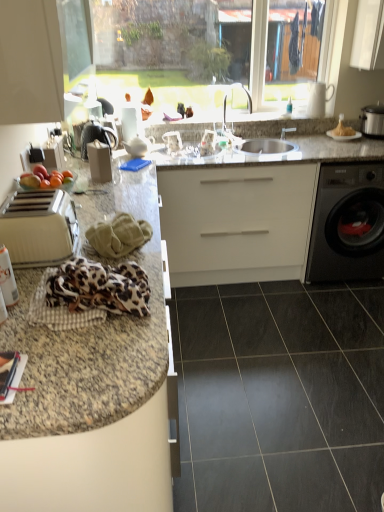
Question: Are white glossy plate at upper right and matte black magazine at lower left beside each other?

Choices:
 (A) no
 (B) yes

Answer: (A)

Question: Is the position of white glossy plate at upper right less distant than that of matte black magazine at lower left?

Choices:
 (A) no
 (B) yes

Answer: (A)

Question: Can you confirm if white glossy plate at upper right is smaller than matte black magazine at lower left?

Choices:
 (A) no
 (B) yes

Answer: (A)

Question: Can you confirm if white glossy plate at upper right is positioned to the right of matte black magazine at lower left?

Choices:
 (A) no
 (B) yes

Answer: (B)

Question: Does white glossy plate at upper right have a larger size compared to matte black magazine at lower left?

Choices:
 (A) no
 (B) yes

Answer: (B)

Question: Is white glossy plate at upper right oriented away from matte black magazine at lower left?

Choices:
 (A) yes
 (B) no

Answer: (B)

Question: Is matte black magazine at lower left positioned in front of leopard print fabric at lower left, placed as the 1th material when sorted from front to back?

Choices:
 (A) yes
 (B) no

Answer: (A)

Question: Is matte black magazine at lower left not near leopard print fabric at lower left, placed as the 1th material when sorted from front to back?

Choices:
 (A) yes
 (B) no

Answer: (B)

Question: From the image's perspective, does matte black magazine at lower left appear higher than leopard print fabric at lower left, arranged as the second material when viewed from the back?

Choices:
 (A) no
 (B) yes

Answer: (A)

Question: Is matte black magazine at lower left looking in the opposite direction of leopard print fabric at lower left, placed as the 1th material when sorted from front to back?

Choices:
 (A) yes
 (B) no

Answer: (B)

Question: Considering the relative sizes of matte black magazine at lower left and leopard print fabric at lower left, placed as the 1th material when sorted from front to back, in the image provided, is matte black magazine at lower left shorter than leopard print fabric at lower left, placed as the 1th material when sorted from front to back,?

Choices:
 (A) yes
 (B) no

Answer: (A)

Question: Considering the relative sizes of matte black magazine at lower left and leopard print fabric at lower left, arranged as the second material when viewed from the back, in the image provided, is matte black magazine at lower left taller than leopard print fabric at lower left, arranged as the second material when viewed from the back,?

Choices:
 (A) no
 (B) yes

Answer: (A)

Question: Is the depth of green fabric at center, the second material in the front-to-back sequence, less than that of silver metallic faucet at center?

Choices:
 (A) no
 (B) yes

Answer: (B)